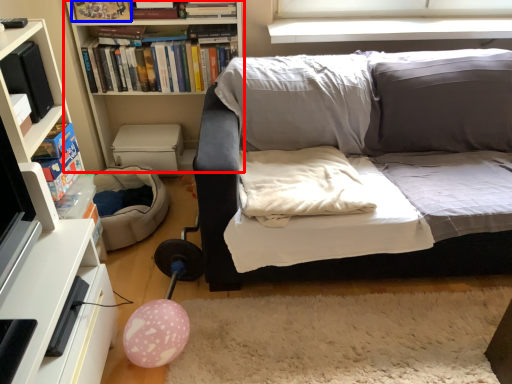
Question: Which object appears closest to the camera in this image, cabinetry (highlighted by a red box) or book (highlighted by a blue box)?

Choices:
 (A) cabinetry
 (B) book

Answer: (B)